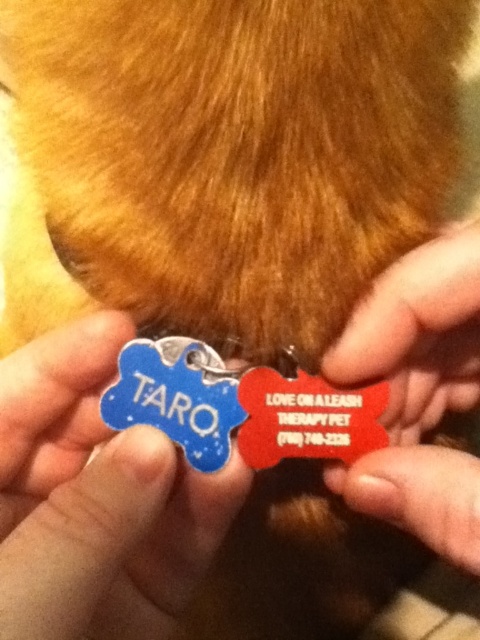
Measure the distance between blue enamel bone at center and matte plastic pet tag at center.

4.82 inches

Which is in front, point (2, 365) or point (422, 259)?

Point (422, 259) is in front.

Who is more distant from viewer, (100, 596) or (458, 362)?

Positioned behind is point (458, 362).

Identify the location of blue enamel bone at center. (96, 499).